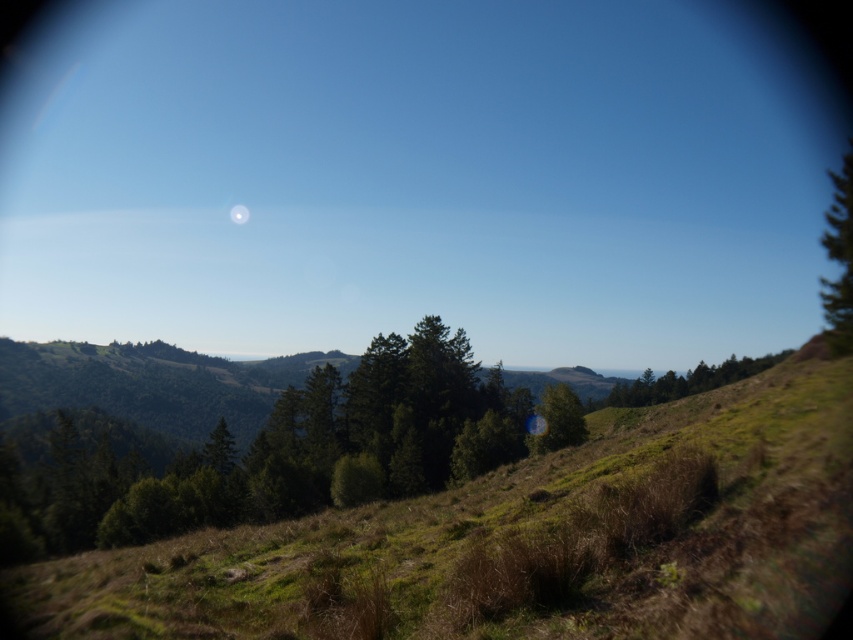
Question: Among these points, which one is farthest from the camera?

Choices:
 (A) (705, 381)
 (B) (94, 596)
 (C) (235, 204)
 (D) (547, 413)

Answer: (C)

Question: Does green matte tree at upper right come in front of green matte tree at center?

Choices:
 (A) no
 (B) yes

Answer: (A)

Question: Which object is the closest to the green textured tree at center?

Choices:
 (A) white glossy moon at upper center
 (B) green grassy hillside at center
 (C) green matte tree at center
 (D) green matte tree at upper right

Answer: (B)

Question: Can you confirm if green matte tree at upper right is wider than white glossy moon at upper center?

Choices:
 (A) yes
 (B) no

Answer: (A)

Question: Which of the following is the farthest from the observer?

Choices:
 (A) (247, 209)
 (B) (850, 579)
 (C) (825, 321)

Answer: (A)

Question: Does green grassy hillside at center appear on the right side of white glossy moon at upper center?

Choices:
 (A) no
 (B) yes

Answer: (B)